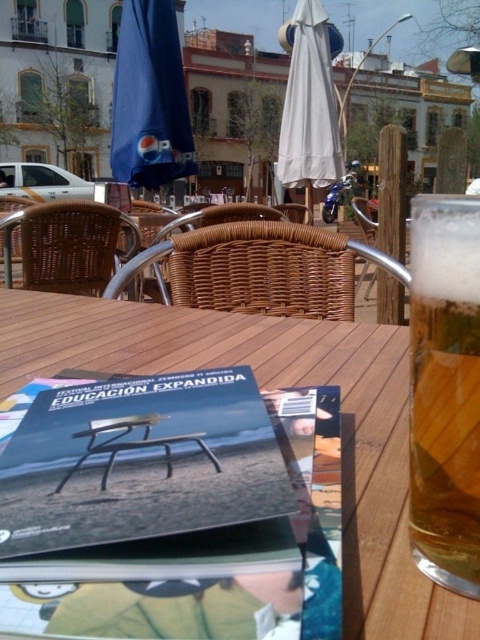
You are standing at the outdoor cafe and want to take a photo of the two points mentioned. Which point, point (252, 442) or point (462, 586), will appear closer to the camera in the photo?

Point (252, 442) is further to the camera than point (462, 586), so it will appear closer in the photo.

You are a customer at the outdoor cafe and want to know if the golden amber liquid at right in your beer glass is taller than the blue fabric umbrella at upper left. Can you confirm?

The golden amber liquid at right is not as tall as the blue fabric umbrella at upper left, so the liquid in the glass is shorter than the umbrella.